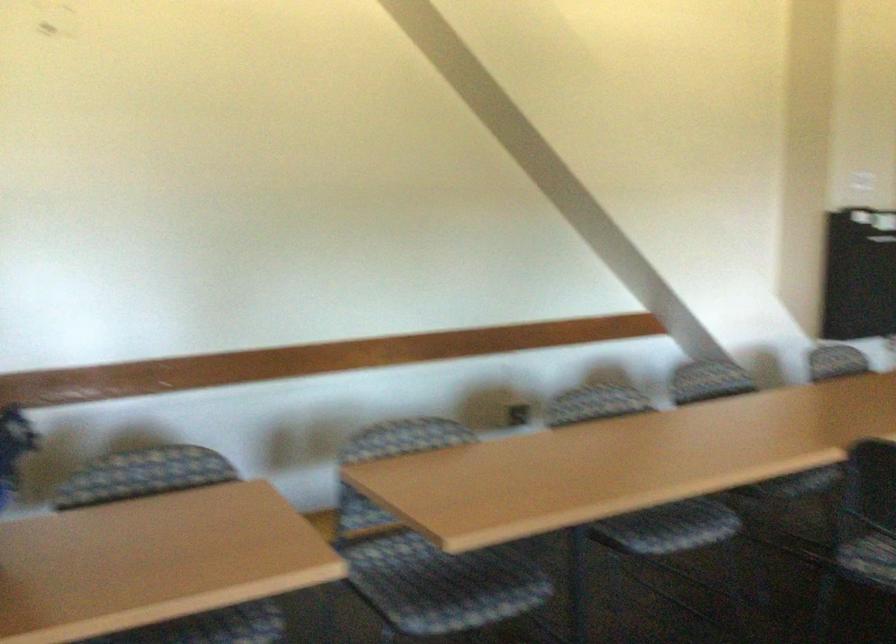
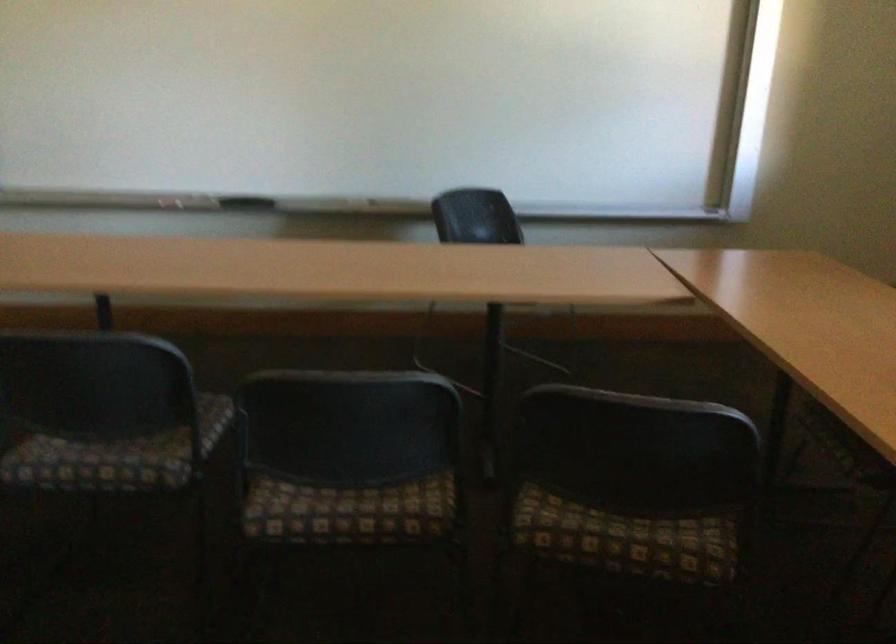
Question: The images are taken continuously from a first-person perspective. In which direction is your viewpoint rotating?

Choices:
 (A) Left
 (B) Right
 (C) Up
 (D) Down

Answer: (B)